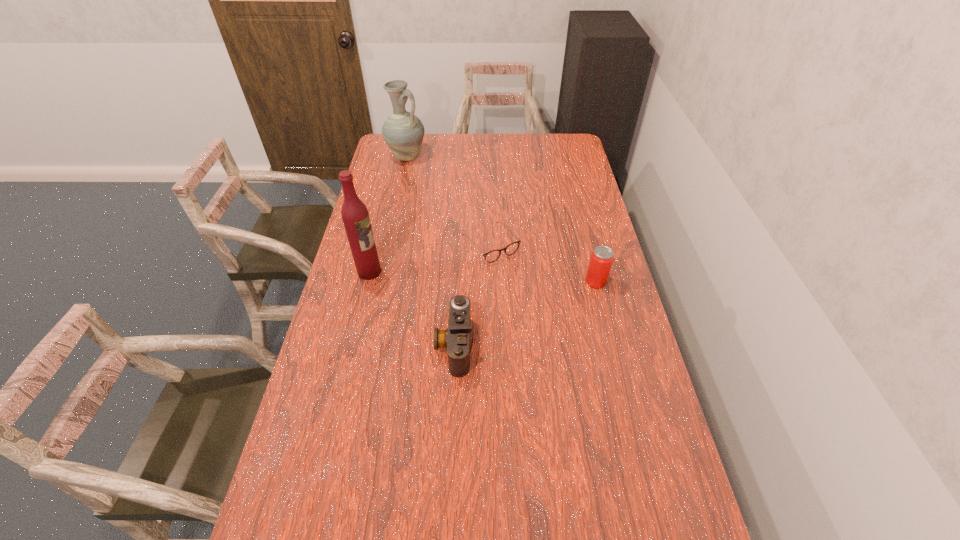
You are a GUI agent. You are given a task and a screenshot of the screen. Output one action in this format:
    pyautogui.click(x=<x>, y=<y>)
    Task: Click on the free space on the desktop that is between the camera and the rightmost object and is positioned through the lenses of the spectacles
    The image size is (960, 540).
    Given the screenshot: What is the action you would take?
    pyautogui.click(x=542, y=305)

You are a GUI agent. You are given a task and a screenshot of the screen. Output one action in this format:
    pyautogui.click(x=<x>, y=<y>)
    Task: Click on the vacant space on the desktop that is between the second shortest object and the third shortest object and is positioned on the handle side of the pitcher
    This screenshot has height=540, width=960.
    Given the screenshot: What is the action you would take?
    click(542, 306)

Where is `free space on the desktop that is between the camera and the rightmost object and is positioned on the label of the liquor`? Image resolution: width=960 pixels, height=540 pixels. free space on the desktop that is between the camera and the rightmost object and is positioned on the label of the liquor is located at coordinates (542, 305).